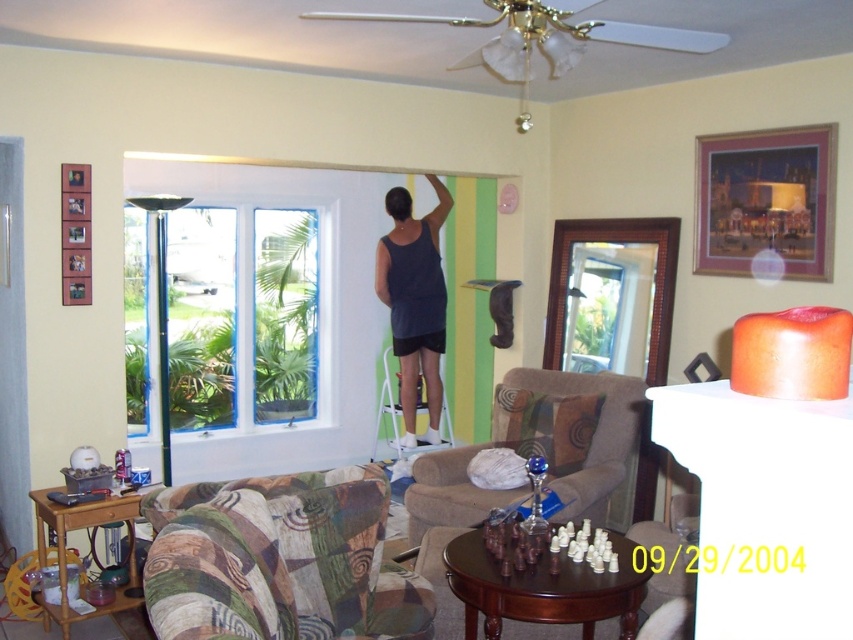
From the picture: Who is positioned more to the right, patchwork fabric couch at lower left or dark blue tank top at center?

dark blue tank top at center is more to the right.

Does point (172, 625) come behind point (421, 310)?

No.

Where is `patchwork fabric couch at lower left`? patchwork fabric couch at lower left is located at coordinates (279, 561).

Can you confirm if patchwork fabric couch at lower left is shorter than white plastic ladder at center?

Indeed, patchwork fabric couch at lower left has a lesser height compared to white plastic ladder at center.

Between patchwork fabric couch at lower left and white plastic ladder at center, which one appears on the left side from the viewer's perspective?

patchwork fabric couch at lower left is more to the left.

The image size is (853, 640). What are the coordinates of `patchwork fabric couch at lower left` in the screenshot? It's located at (279, 561).

The height and width of the screenshot is (640, 853). Identify the location of patchwork fabric couch at lower left. (279, 561).

Is point (302, 380) less distant than point (389, 412)?

Yes, it is.

Does white painted window at left lie behind white plastic ladder at center?

No, it is in front of white plastic ladder at center.

The height and width of the screenshot is (640, 853). What do you see at coordinates (183, 314) in the screenshot?
I see `white painted window at left` at bounding box center [183, 314].

You are a GUI agent. You are given a task and a screenshot of the screen. Output one action in this format:
    pyautogui.click(x=<x>, y=<y>)
    Task: Click on the white painted window at left
    This screenshot has width=853, height=640.
    Given the screenshot: What is the action you would take?
    pyautogui.click(x=183, y=314)